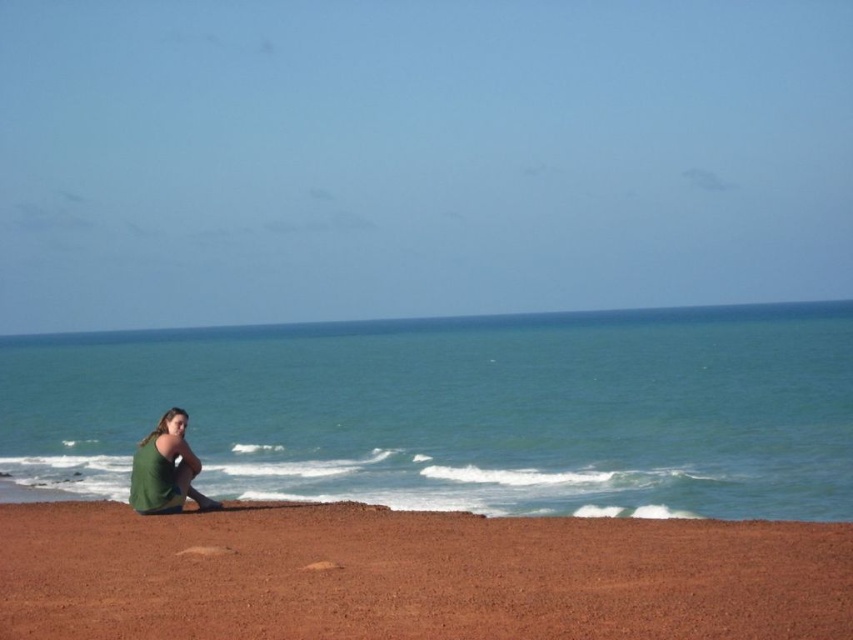
Question: Is reddish-brown gravel at lower center thinner than green fabric at lower left?

Choices:
 (A) no
 (B) yes

Answer: (B)

Question: Which of the following is the closest to the observer?

Choices:
 (A) green water at center
 (B) green fabric at lower left
 (C) reddish-brown gravel at lower center

Answer: (C)

Question: Among these points, which one is farthest from the camera?

Choices:
 (A) (41, 540)
 (B) (144, 444)

Answer: (B)

Question: Which object is positioned closest to the green fabric at lower left?

Choices:
 (A) reddish-brown gravel at lower center
 (B) green water at center

Answer: (A)

Question: Is green water at center closer to the viewer compared to green fabric at lower left?

Choices:
 (A) yes
 (B) no

Answer: (B)

Question: Is green water at center in front of green fabric at lower left?

Choices:
 (A) no
 (B) yes

Answer: (A)